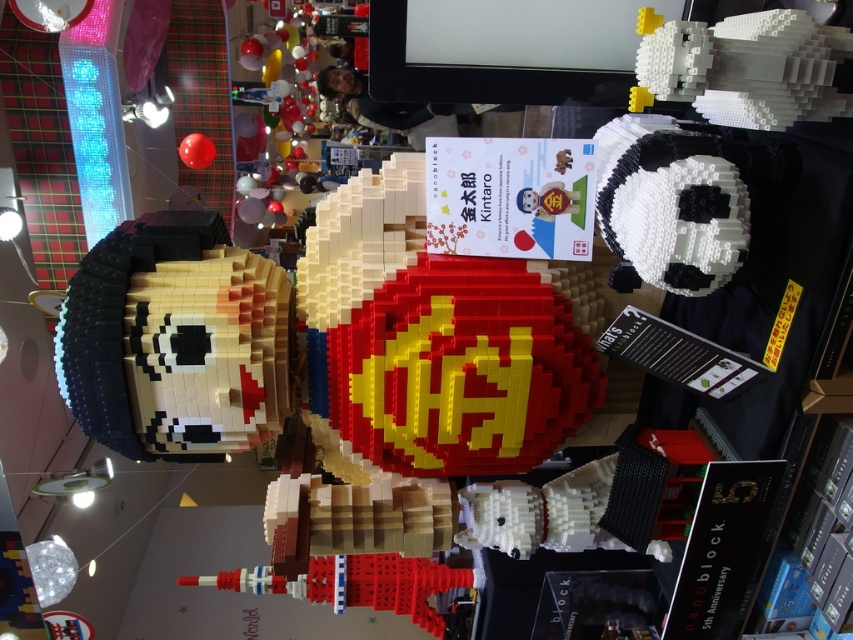
Question: Which of these objects is positioned closest to the white matte lego chicken at upper right?

Choices:
 (A) matte black panda at upper right
 (B) brick-like face at left

Answer: (B)

Question: Is brick-like face at left to the right of matte black panda at upper right from the viewer's perspective?

Choices:
 (A) yes
 (B) no

Answer: (A)

Question: Can you confirm if black matte panda head at upper right is positioned to the left of white matte lego chicken at upper right?

Choices:
 (A) no
 (B) yes

Answer: (B)

Question: Which of these objects is positioned closest to the matte black panda at upper right?

Choices:
 (A) white matte lego chicken at upper right
 (B) black matte panda head at upper right

Answer: (B)

Question: Observing the image, what is the correct spatial positioning of brick-like face at left in reference to white matte lego chicken at upper right?

Choices:
 (A) left
 (B) right

Answer: (A)

Question: Estimate the real-world distances between objects in this image. Which object is farther from the white matte lego chicken at upper right?

Choices:
 (A) brick-like face at left
 (B) matte black panda at upper right
 (C) black matte panda head at upper right

Answer: (B)